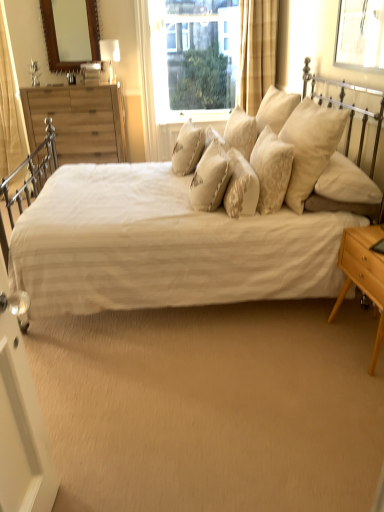
Locate an element on the screen. The width and height of the screenshot is (384, 512). free spot in front of light wood/texture nightstand at lower right is located at coordinates (355, 390).